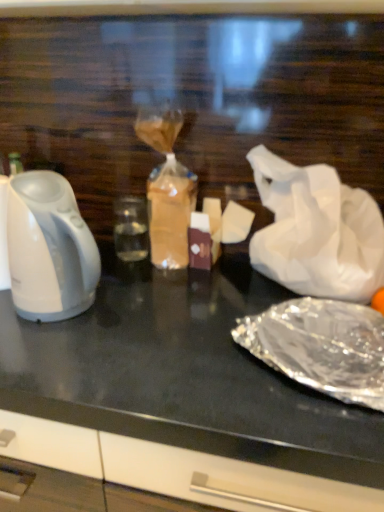
Question: From a real-world perspective, is black glossy table at center above or below white glossy kettle at left?

Choices:
 (A) below
 (B) above

Answer: (A)

Question: In the image, is black glossy table at center positioned in front of or behind white glossy kettle at left?

Choices:
 (A) behind
 (B) front

Answer: (B)

Question: Which object is positioned farthest from the black glossy table at center?

Choices:
 (A) white crumpled paper at right
 (B) white glossy kettle at left
 (C) shiny metallic foil at lower right

Answer: (A)

Question: Based on their relative distances, which object is farther from the white crumpled paper at right?

Choices:
 (A) black glossy table at center
 (B) white glossy kettle at left
 (C) shiny metallic foil at lower right

Answer: (B)